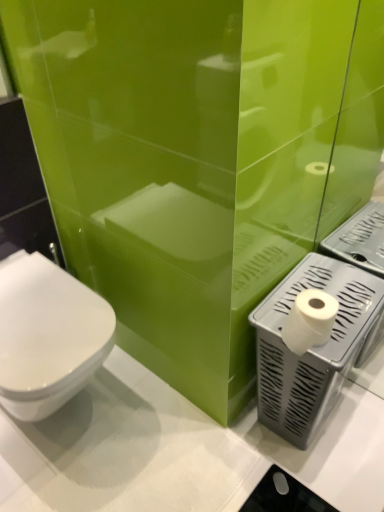
Where is `free point above white glossy toilet at left (from a real-world perspective)`? The width and height of the screenshot is (384, 512). free point above white glossy toilet at left (from a real-world perspective) is located at coordinates (41, 312).